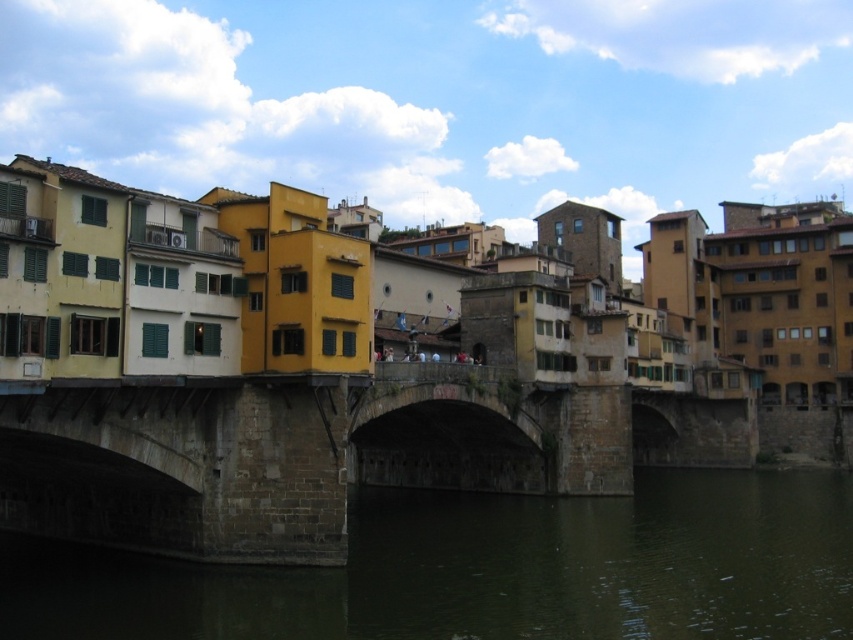
What do you see at coordinates (486, 570) in the screenshot?
I see `dark green water at center` at bounding box center [486, 570].

Between dark green water at center and stone bridge at center, which one is positioned lower?

dark green water at center is below.

Does point (683, 512) lie behind point (437, 481)?

No, it is not.

At what (x,y) coordinates should I click in order to perform the action: click on dark green water at center. Please return your answer as a coordinate pair (x, y). Looking at the image, I should click on (486, 570).